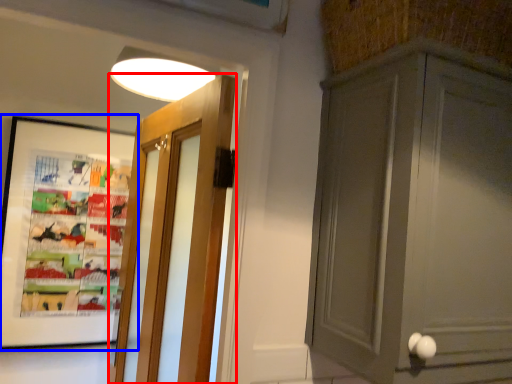
Question: Among these objects, which one is farthest to the camera, door (highlighted by a red box) or picture frame (highlighted by a blue box)?

Choices:
 (A) door
 (B) picture frame

Answer: (B)